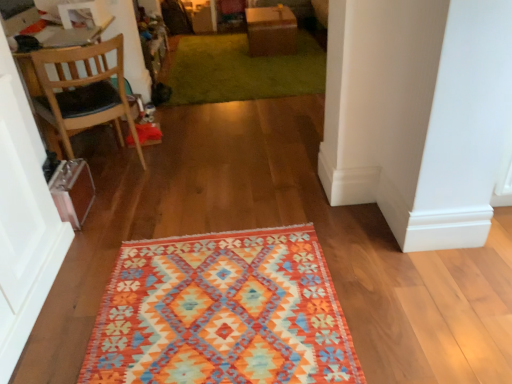
I want to click on green shaggy rug at upper center, so coord(241,70).

Identify the location of textured woolen rug at center. The image size is (512, 384). (222, 313).

Identify the location of green shaggy rug at upper center. (241, 70).

Could you tell me if brown cardboard box at upper center is turned towards wooden chair at left?

No, brown cardboard box at upper center is not aimed at wooden chair at left.

From a real-world perspective, is brown cardboard box at upper center physically located above or below wooden chair at left?

brown cardboard box at upper center is situated lower than wooden chair at left in the real world.

Find the location of a particular element. Image resolution: width=512 pixels, height=384 pixels. chair above the brown cardboard box at upper center (from a real-world perspective) is located at coordinates (83, 91).

How different are the orientations of brown cardboard box at upper center and wooden chair at left in degrees?

The angle between the facing direction of brown cardboard box at upper center and the facing direction of wooden chair at left is 55.4 degrees.

Does textured woolen rug at center lie behind wooden chair at left?

That is False.

Is textured woolen rug at center bigger or smaller than wooden chair at left?

In the image, textured woolen rug at center appears to be smaller than wooden chair at left.

Based on their positions, is textured woolen rug at center located to the left or right of wooden chair at left?

textured woolen rug at center is to the right of wooden chair at left.

Is textured woolen rug at center in contact with wooden chair at left?

There is a gap between textured woolen rug at center and wooden chair at left.

In the scene shown: From the image's perspective, is brown cardboard box at upper center above or below green shaggy rug at upper center?

From the image's perspective, brown cardboard box at upper center appears above green shaggy rug at upper center.

How many degrees apart are the facing directions of brown cardboard box at upper center and green shaggy rug at upper center?

There is a 92-degree angle between the facing directions of brown cardboard box at upper center and green shaggy rug at upper center.

Is brown cardboard box at upper center smaller than green shaggy rug at upper center?

Indeed, brown cardboard box at upper center has a smaller size compared to green shaggy rug at upper center.

Is brown cardboard box at upper center spatially inside green shaggy rug at upper center, or outside of it?

brown cardboard box at upper center is not inside green shaggy rug at upper center, it's outside.

Is wooden chair at left not within brown cardboard box at upper center?

wooden chair at left is positioned outside brown cardboard box at upper center.

From a real-world perspective, is wooden chair at left above or below brown cardboard box at upper center?

wooden chair at left is above brown cardboard box at upper center.

You are a GUI agent. You are given a task and a screenshot of the screen. Output one action in this format:
    pyautogui.click(x=<x>, y=<y>)
    Task: Click on the table below the wooden chair at left (from a real-world perspective)
    The height and width of the screenshot is (384, 512).
    Given the screenshot: What is the action you would take?
    point(271,30)

Looking at this image, which is closer to the camera, (49, 90) or (275, 33)?

Positioned in front is point (49, 90).

How far apart are textured woolen rug at center and brown cardboard box at upper center?

A distance of 3.29 meters exists between textured woolen rug at center and brown cardboard box at upper center.

From the image's perspective, is textured woolen rug at center located above brown cardboard box at upper center?

No, from the image's perspective, textured woolen rug at center is not above brown cardboard box at upper center.

Which object is closer to the camera taking this photo, textured woolen rug at center or brown cardboard box at upper center?

textured woolen rug at center is in front.

Between wooden chair at left and green shaggy rug at upper center, which one appears on the left side from the viewer's perspective?

wooden chair at left.

From a real-world perspective, who is located lower, wooden chair at left or green shaggy rug at upper center?

green shaggy rug at upper center.

Considering the points (73, 51) and (236, 92), which point is behind, point (73, 51) or point (236, 92)?

The point (236, 92) is farther from the camera.

The image size is (512, 384). Find the location of `chair in front of the green shaggy rug at upper center`. chair in front of the green shaggy rug at upper center is located at coordinates (83, 91).

Is wooden chair at left taller than textured woolen rug at center?

Correct, wooden chair at left is much taller as textured woolen rug at center.

From a real-world perspective, which object stands above the other?

wooden chair at left is physically above.

Does point (124, 115) lie in front of point (348, 381)?

No, it is behind (348, 381).

Is wooden chair at left not near textured woolen rug at center?

Yes, wooden chair at left is far from textured woolen rug at center.

In the image, there is a wooden chair at left. Identify the location of table below it (from a real-world perspective). (271, 30).

I want to click on chair that appears above the textured woolen rug at center (from the image's perspective), so click(83, 91).

Based on their spatial positions, is green shaggy rug at upper center or brown cardboard box at upper center closer to textured woolen rug at center?

green shaggy rug at upper center is positioned closer to the anchor textured woolen rug at center.

Which object lies nearer to the anchor point wooden chair at left, textured woolen rug at center or brown cardboard box at upper center?

Among the two, textured woolen rug at center is located nearer to wooden chair at left.

Looking at the image, which one is located further to wooden chair at left, brown cardboard box at upper center or textured woolen rug at center?

brown cardboard box at upper center is further to wooden chair at left.

When comparing their distances from wooden chair at left, does green shaggy rug at upper center or brown cardboard box at upper center seem further?

brown cardboard box at upper center.

Which object lies nearer to the anchor point wooden chair at left, brown cardboard box at upper center or green shaggy rug at upper center?

green shaggy rug at upper center.

Which object lies nearer to the anchor point green shaggy rug at upper center, wooden chair at left or textured woolen rug at center?

The object closer to green shaggy rug at upper center is wooden chair at left.

From the image, which object appears to be farther from brown cardboard box at upper center, wooden chair at left or green shaggy rug at upper center?

wooden chair at left lies further to brown cardboard box at upper center than the other object.

Estimate the real-world distances between objects in this image. Which object is further from textured woolen rug at center, green shaggy rug at upper center or wooden chair at left?

green shaggy rug at upper center is further to textured woolen rug at center.

The image size is (512, 384). Find the location of `doormat positioned between textured woolen rug at center and brown cardboard box at upper center from near to far`. doormat positioned between textured woolen rug at center and brown cardboard box at upper center from near to far is located at coordinates (241, 70).

At what (x,y) coordinates should I click in order to perform the action: click on chair positioned between textured woolen rug at center and brown cardboard box at upper center from near to far. Please return your answer as a coordinate pair (x, y). Looking at the image, I should click on (83, 91).

Where is `doormat positioned between wooden chair at left and brown cardboard box at upper center from near to far`? The height and width of the screenshot is (384, 512). doormat positioned between wooden chair at left and brown cardboard box at upper center from near to far is located at coordinates (241, 70).

Identify the location of chair between textured woolen rug at center and green shaggy rug at upper center along the z-axis. This screenshot has width=512, height=384. (83, 91).